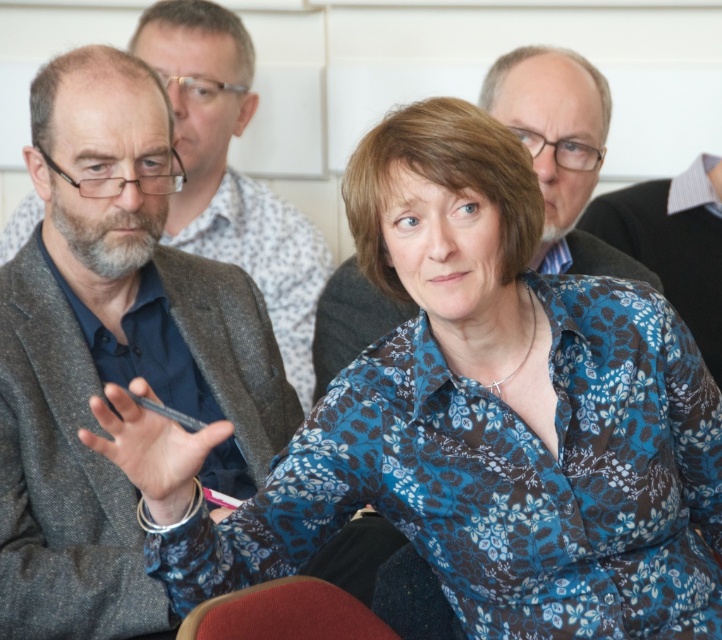
You are organizing a photo shoot and need to place two jackets in a display case. The display case has two compartments. The first compartment can only accommodate items up to the width of the matte black jacket at upper center. The second compartment can hold items up to the width of the gray woolen jacket at center. Which jacket should go into which compartment?

The matte black jacket at upper center should go into the first compartment, and the gray woolen jacket at center should go into the second compartment because the gray woolen jacket at center is wider than the matte black jacket at upper center.

You are sitting in the red fabric chair at lower center and want to hand a document to the person wearing the matte black jacket at upper center. Can you reach them directly without getting up?

The red fabric chair at lower center is behind matte black jacket at upper center, so you cannot reach them directly without getting up.